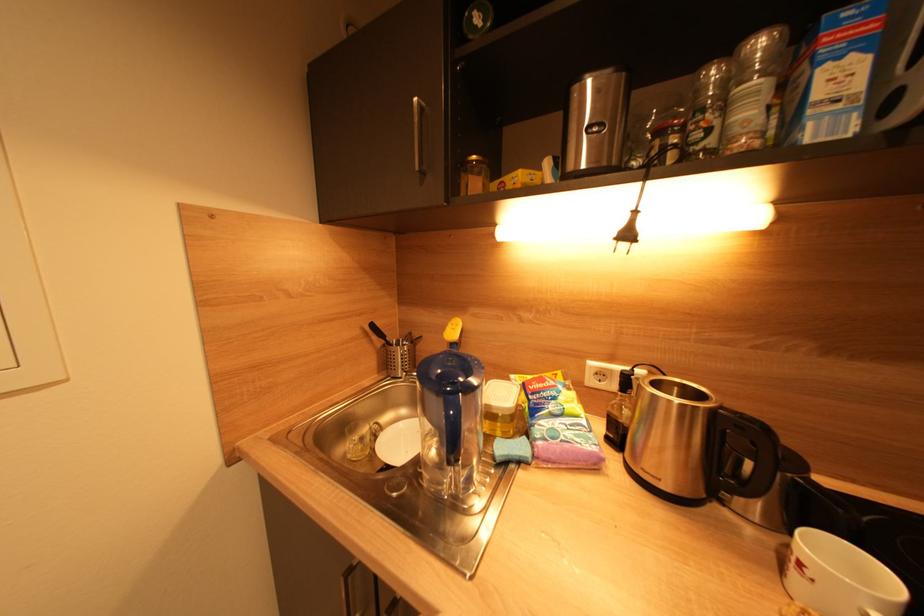
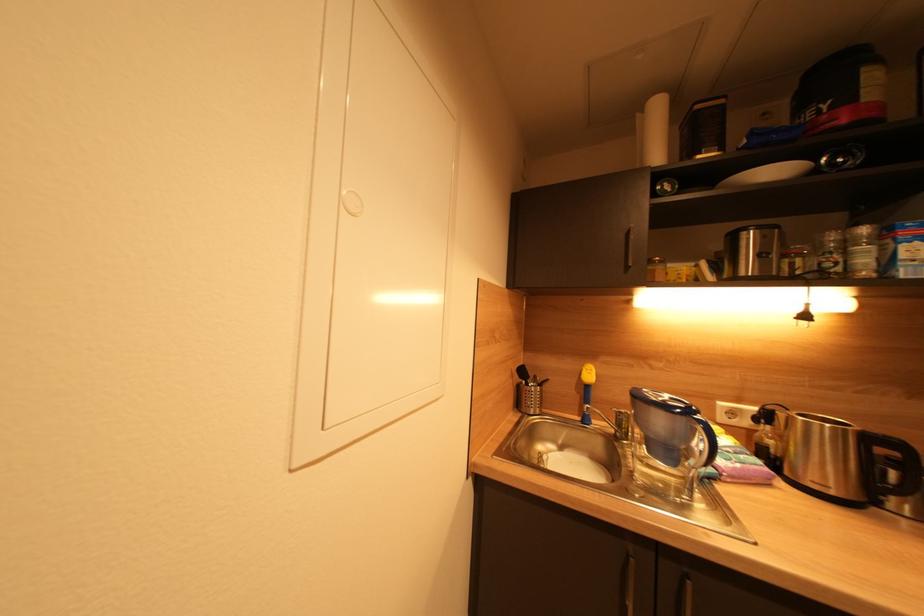
Question: What movement of the cameraman would produce the second image?

Choices:
 (A) Left
 (B) Right
 (C) Forward
 (D) Backward

Answer: (A)